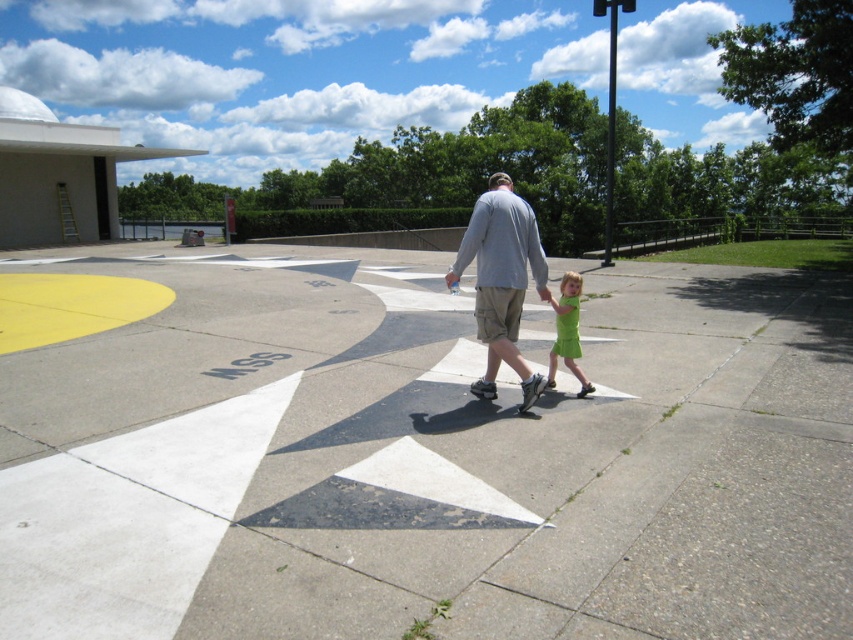
From the picture: Is gray cotton shirt at center shorter than green cotton dress at lower right?

In fact, gray cotton shirt at center may be taller than green cotton dress at lower right.

Between gray cotton shirt at center and green cotton dress at lower right, which one is positioned lower?

Positioned lower is green cotton dress at lower right.

Is point (490, 387) less distant than point (583, 378)?

Yes, point (490, 387) is in front of point (583, 378).

Locate an element on the screen. gray cotton shirt at center is located at coordinates (502, 280).

Is gray concrete pavement at center positioned before green cotton dress at lower right?

Yes, it is in front of green cotton dress at lower right.

Does gray concrete pavement at center appear under green cotton dress at lower right?

No.

Is point (323, 433) closer to viewer compared to point (573, 301)?

Yes.

This screenshot has height=640, width=853. In order to click on gray concrete pavement at center in this screenshot , I will do `click(421, 456)`.

Is the position of gray concrete pavement at center more distant than that of gray cotton shirt at center?

No, gray concrete pavement at center is closer to the viewer.

Which is in front, point (126, 468) or point (521, 246)?

Point (126, 468) is in front.

In the scene shown: Measure the distance between point (108, 589) and camera.

They are 3.13 meters apart.

Where is `gray concrete pavement at center`? gray concrete pavement at center is located at coordinates (421, 456).